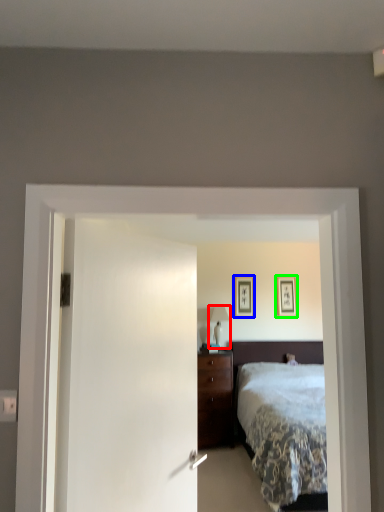
Question: Which object is the farthest from table lamp (highlighted by a red box)? Choose among these: picture frame (highlighted by a blue box) or picture frame (highlighted by a green box).

Choices:
 (A) picture frame
 (B) picture frame

Answer: (B)